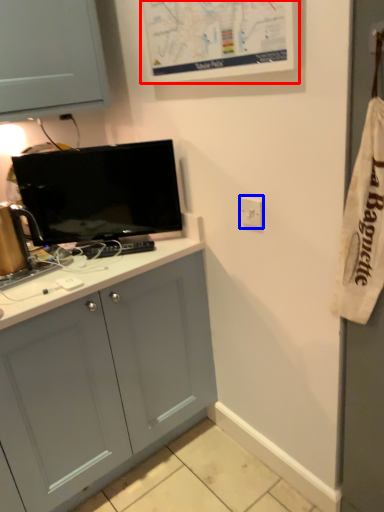
Question: Which object appears closest to the camera in this image, bulletin board (highlighted by a red box) or electric outlet (highlighted by a blue box)?

Choices:
 (A) bulletin board
 (B) electric outlet

Answer: (A)